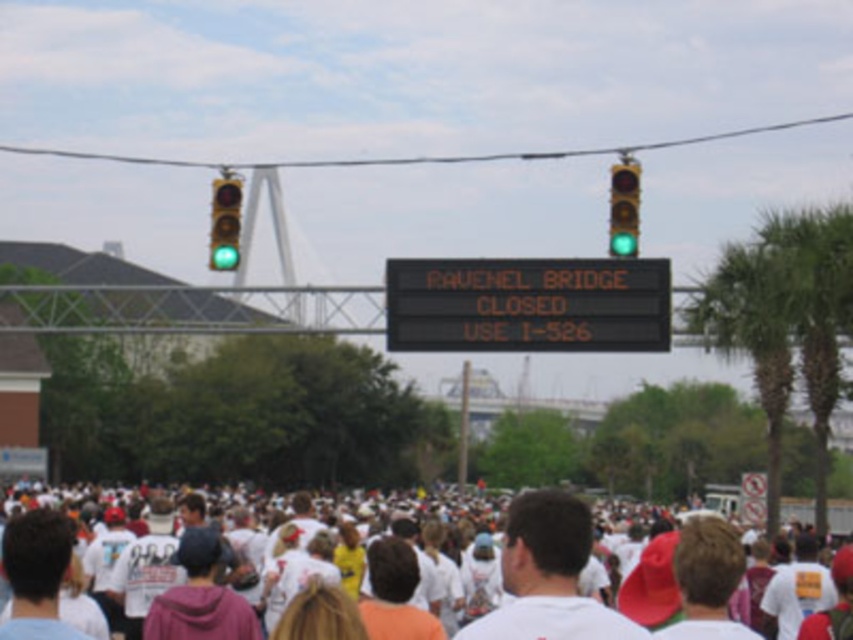
Can you confirm if black electronic scoreboard at center is positioned to the right of green glass traffic light at left?

Yes, black electronic scoreboard at center is to the right of green glass traffic light at left.

Is black electronic scoreboard at center above green glass traffic light at left?

Actually, black electronic scoreboard at center is below green glass traffic light at left.

Locate an element on the screen. This screenshot has width=853, height=640. black electronic scoreboard at center is located at coordinates (527, 305).

Is point (502, 582) in front of point (222, 188)?

That is True.

Identify the location of white cotton crowd at lower center. (619, 586).

Does point (496, 632) come in front of point (224, 193)?

That is True.

At what (x,y) coordinates should I click in order to perform the action: click on white cotton crowd at lower center. Please return your answer as a coordinate pair (x, y). The width and height of the screenshot is (853, 640). Looking at the image, I should click on (619, 586).

Between white cotton crowd at lower center and black electronic scoreboard at center, which one appears on the left side from the viewer's perspective?

From the viewer's perspective, white cotton crowd at lower center appears more on the left side.

In the scene shown: Between white cotton crowd at lower center and black electronic scoreboard at center, which one has more height?

With more height is white cotton crowd at lower center.

What are the coordinates of `white cotton crowd at lower center` in the screenshot? It's located at (619, 586).

The height and width of the screenshot is (640, 853). Find the location of `white cotton crowd at lower center`. white cotton crowd at lower center is located at coordinates (619, 586).